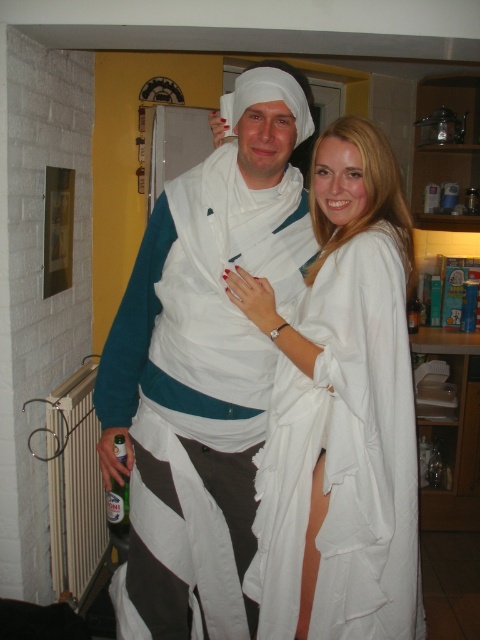
Is white cotton toga at center to the left of white fabric dress at center from the viewer's perspective?

Yes, white cotton toga at center is to the left of white fabric dress at center.

Based on the photo, who is more distant from viewer, (262, 243) or (360, 438)?

The point (262, 243) is more distant.

Find the location of a particular element. The image size is (480, 640). white cotton toga at center is located at coordinates (204, 365).